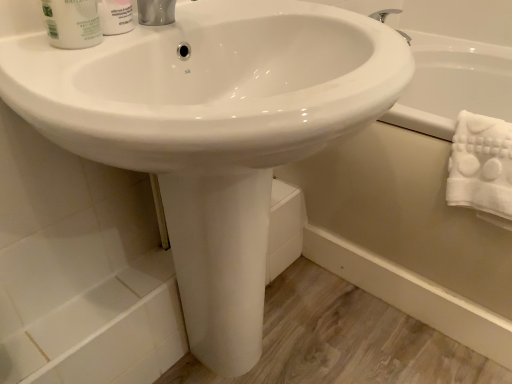
Question: From the image's perspective, relative to white glossy bathtub at lower right, is white matte shaving cream at upper left above or below?

Choices:
 (A) above
 (B) below

Answer: (A)

Question: Is point (128, 29) positioned closer to the camera than point (371, 246)?

Choices:
 (A) farther
 (B) closer

Answer: (B)

Question: Which is nearer to the white glossy bathtub at lower right?

Choices:
 (A) white glossy mouthwash at upper left
 (B) white matte shaving cream at upper left
 (C) white fluffy towel at right

Answer: (C)

Question: Which of these objects is positioned farthest from the white fluffy towel at right?

Choices:
 (A) white matte shaving cream at upper left
 (B) white glossy bathtub at lower right
 (C) white glossy mouthwash at upper left

Answer: (C)